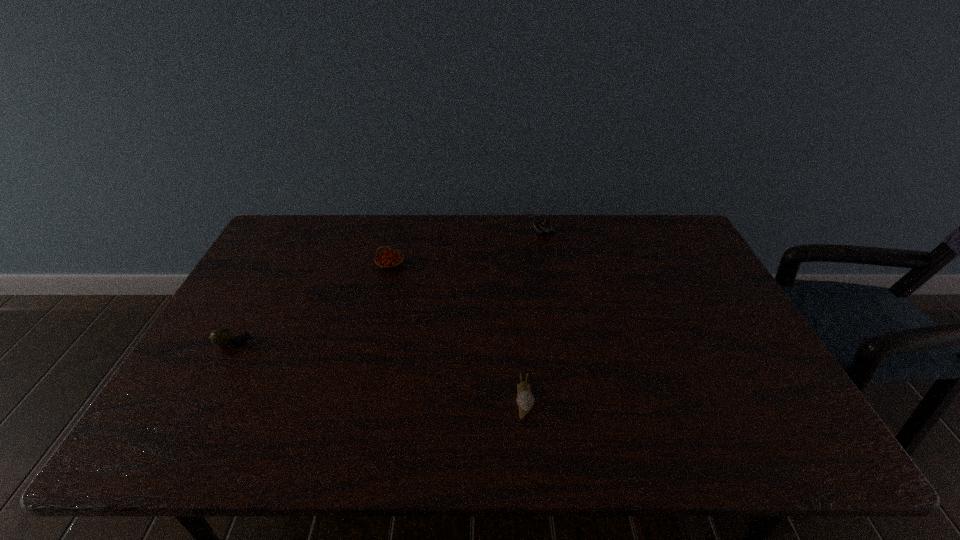
You are a GUI agent. You are given a task and a screenshot of the screen. Output one action in this format:
    pyautogui.click(x=<x>, y=<y>)
    Task: Click on the vacant space in between the rightmost object and the strawberry
    Image resolution: width=960 pixels, height=540 pixels.
    Given the screenshot: What is the action you would take?
    [x=466, y=248]

The image size is (960, 540). I want to click on free spot between the second object from left to right and the shortest escargot, so click(x=457, y=332).

The width and height of the screenshot is (960, 540). In order to click on object that is the second nearest to the shortest escargot in this screenshot , I will do `click(546, 225)`.

Locate an element on the screen. object that stands as the closest to the shortest escargot is located at coordinates (389, 259).

Select which escargot appears as the second closest to the second escargot from right to left. Please provide its 2D coordinates. Your answer should be formatted as a tuple, i.e. [(x, y)], where the tuple contains the x and y coordinates of a point satisfying the conditions above.

[(222, 337)]

Identify which escargot is located as the nearest to the nearest escargot. Please provide its 2D coordinates. Your answer should be formatted as a tuple, i.e. [(x, y)], where the tuple contains the x and y coordinates of a point satisfying the conditions above.

[(546, 225)]